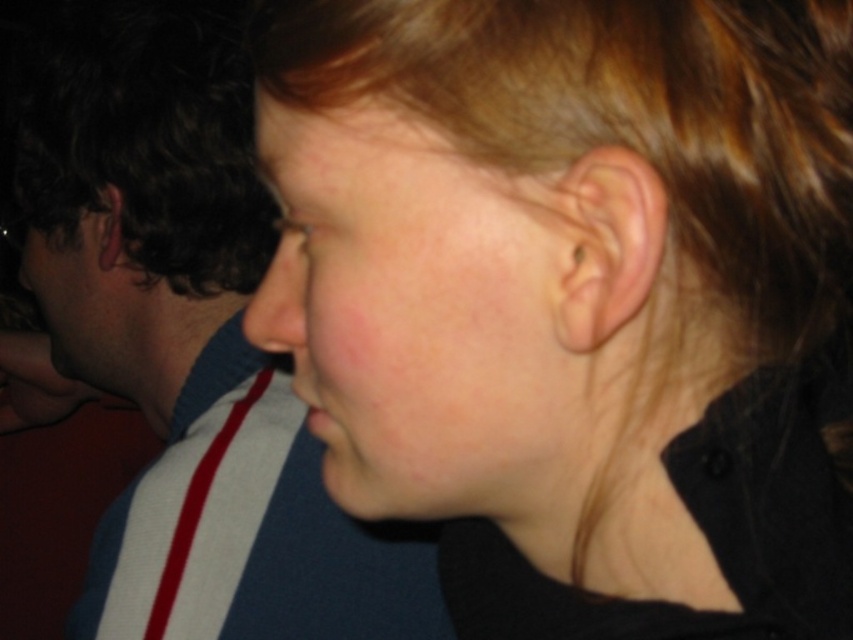
You are a photographer trying to adjust the lighting for a portrait. You notice two areas of the subject in the image, the smooth skin at center and the matte black face at left. Which area is located to the right of the other?

The smooth skin at center is positioned on the right side of matte black face at left.

You are a photographer adjusting lighting for a portrait. You notice two areas of concern in the image described. The smooth skin at center and the matte black face at left. Which area might require more light to ensure proper exposure?

The matte black face at left requires more light because it is larger in size compared to the smooth skin at center, which may absorb more light and appear underexposed without additional illumination.

You are a photographer adjusting lighting for a portrait session. You notice two subjects in the frame, the smooth skin face at center and the matte black face at left. Based on their positions and sizes, which subject would appear closer to the camera?

The smooth skin face at center has a lesser width compared to matte black face at left, so the matte black face at left appears closer to the camera since it is wider.